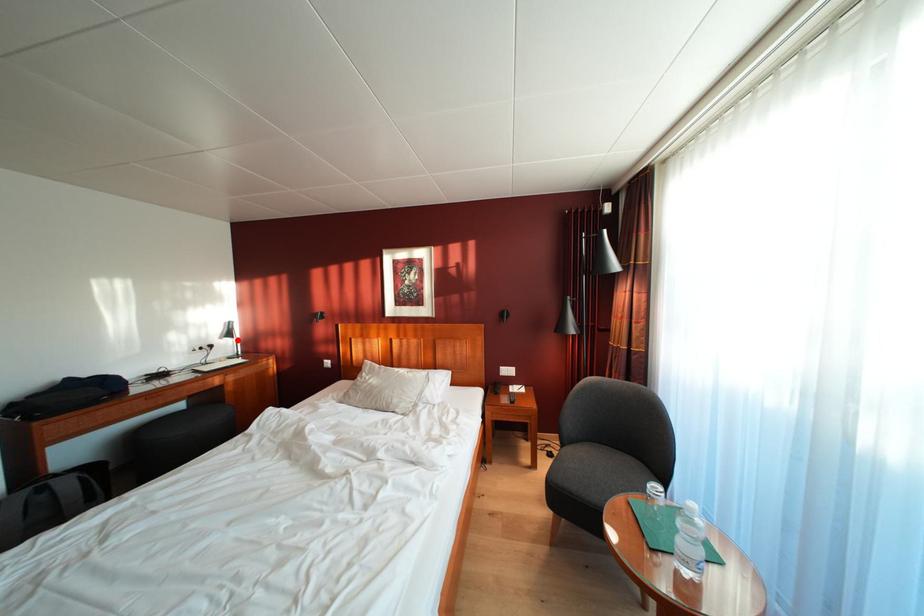
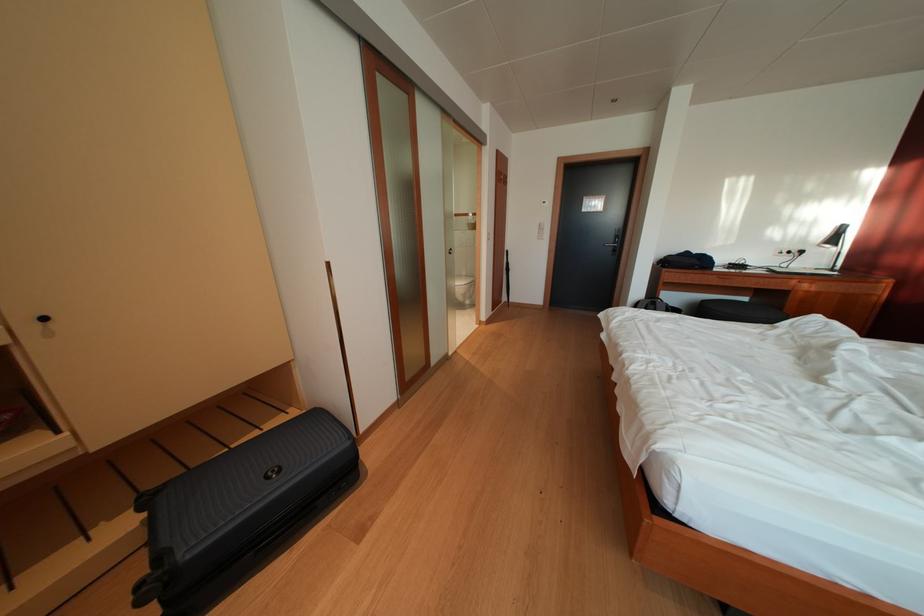
Locate, in the second image, the point that corresponds to the highlighted location in the first image.

(842, 246)